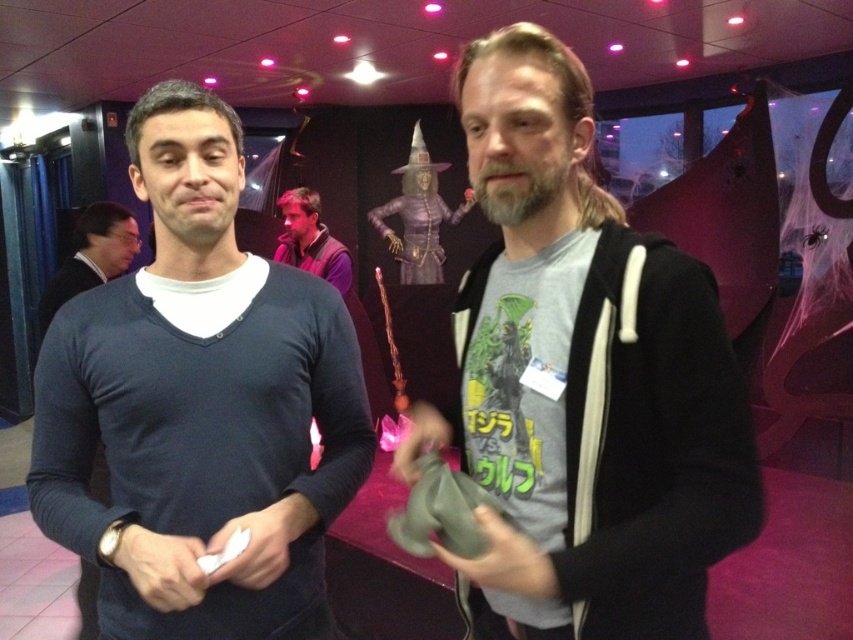
Question: Estimate the real-world distances between objects in this image. Which object is closer to the matte black sweater at left?

Choices:
 (A) purple velvet shirt at center
 (B) dark blue sweater at left

Answer: (A)

Question: Where is dark blue sweater at left located in relation to purple velvet shirt at center in the image?

Choices:
 (A) right
 (B) left

Answer: (A)

Question: Can you confirm if dark blue sweater at left is bigger than purple velvet shirt at center?

Choices:
 (A) yes
 (B) no

Answer: (B)

Question: Which point is farther from the camera taking this photo?

Choices:
 (A) (86, 241)
 (B) (543, 312)
 (C) (286, 200)
 (D) (131, 556)

Answer: (C)

Question: Based on their relative distances, which object is nearer to the purple velvet shirt at center?

Choices:
 (A) matte black sweater at left
 (B) gray matte t-shirt at center

Answer: (A)

Question: Does dark blue sweater at left appear on the right side of purple velvet shirt at center?

Choices:
 (A) no
 (B) yes

Answer: (B)